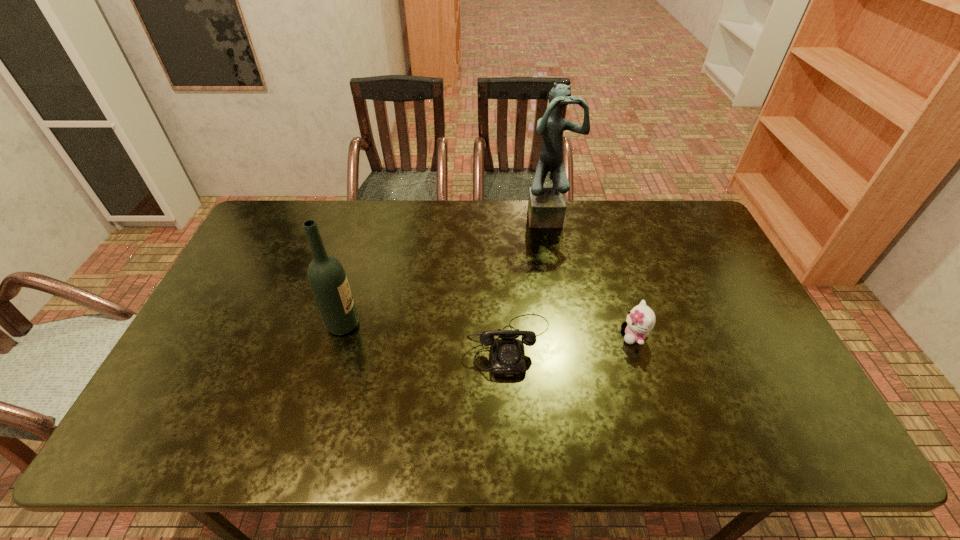
Where is `vacant space positioned on the front-facing side of the third tallest object`? vacant space positioned on the front-facing side of the third tallest object is located at coordinates (540, 336).

Locate an element on the screen. The image size is (960, 540). free point located 0.260m on the front-facing side of the third tallest object is located at coordinates point(526,336).

Where is `free space located on the front-facing side of the telephone`? This screenshot has height=540, width=960. free space located on the front-facing side of the telephone is located at coordinates (513, 396).

Identify the location of object that is at the far edge. (546, 206).

You are a GUI agent. You are given a task and a screenshot of the screen. Output one action in this format:
    pyautogui.click(x=<x>, y=<y>)
    Task: Click on the vacant area at the far edge of the desktop
    The height and width of the screenshot is (540, 960).
    Given the screenshot: What is the action you would take?
    pyautogui.click(x=576, y=238)

In the image, there is a desktop. Where is `vacant space at the near edge`? The image size is (960, 540). vacant space at the near edge is located at coordinates (621, 437).

Find the location of a particular element. vacant area at the left edge is located at coordinates (181, 397).

Where is `free spot at the right edge of the desktop`? This screenshot has height=540, width=960. free spot at the right edge of the desktop is located at coordinates (717, 280).

The width and height of the screenshot is (960, 540). Find the location of `free space at the near right corner of the desktop`. free space at the near right corner of the desktop is located at coordinates (784, 448).

You are a GUI agent. You are given a task and a screenshot of the screen. Output one action in this format:
    pyautogui.click(x=<x>, y=<y>)
    Task: Click on the vacant region between the third shortest object and the telephone
    The width and height of the screenshot is (960, 540).
    Given the screenshot: What is the action you would take?
    pyautogui.click(x=426, y=335)